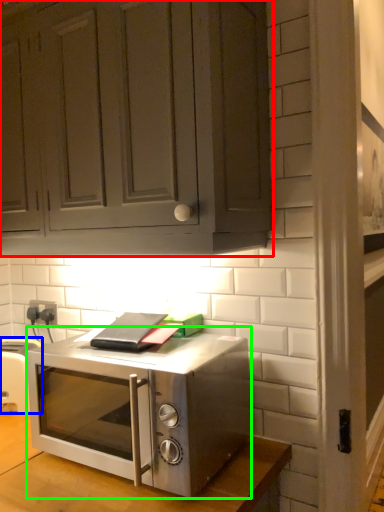
Question: Based on their relative distances, which object is nearer to cabinetry (highlighted by a red box)? Choose from appliance (highlighted by a blue box) and microwave oven (highlighted by a green box).

Choices:
 (A) appliance
 (B) microwave oven

Answer: (B)